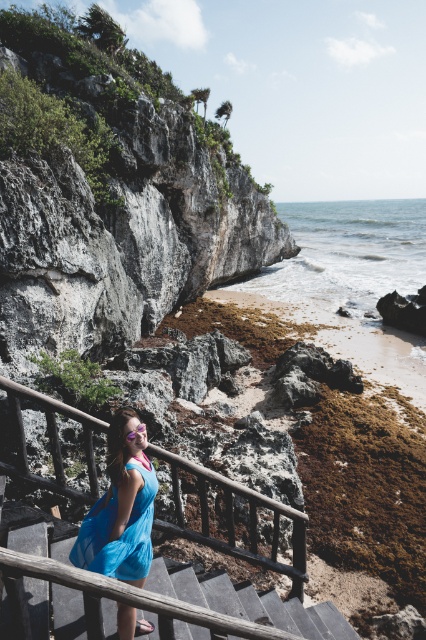
Question: Which of the following is the closest to the observer?

Choices:
 (A) (100, 552)
 (B) (284, 636)
 (C) (189, 156)
 (D) (184, 458)

Answer: (B)

Question: From the image, what is the correct spatial relationship of wooden at center in relation to blue fabric dress at center?

Choices:
 (A) above
 (B) below

Answer: (B)

Question: Which of the following is the farthest from the observer?

Choices:
 (A) rugged stone cliff at center
 (B) blue fabric dress at center
 (C) wooden at center

Answer: (A)

Question: Which object is farther from the camera taking this photo?

Choices:
 (A) blue fabric dress at center
 (B) rugged stone cliff at center
 (C) wooden stairs at center
 (D) wooden at center

Answer: (B)

Question: Is blue fabric dress at center positioned before wooden stairs at center?

Choices:
 (A) yes
 (B) no

Answer: (B)

Question: Is wooden at center below blue fabric dress at center?

Choices:
 (A) no
 (B) yes

Answer: (B)